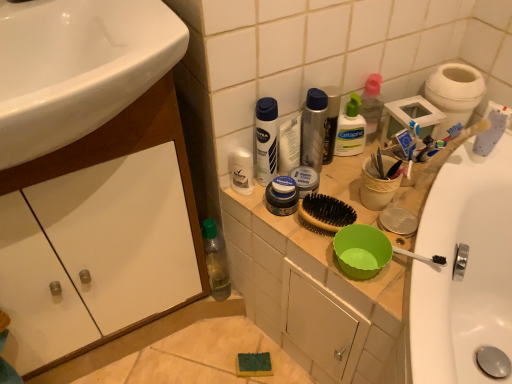
I want to click on vacant space situated above matte plastic toiletries at upper right (from a real-world perspective), so click(380, 221).